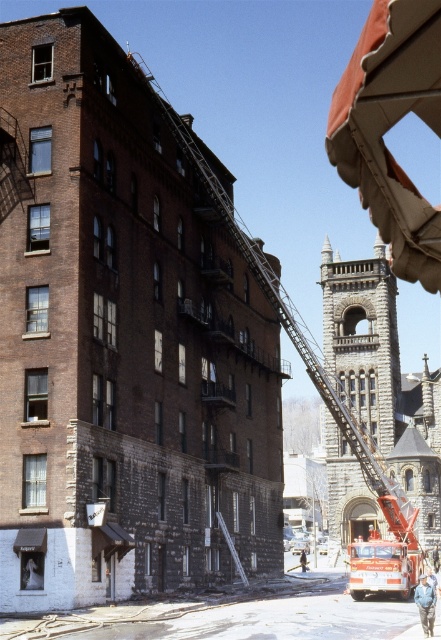
Question: Among these points, which one is nearest to the camera?

Choices:
 (A) (257, 266)
 (B) (231, 545)

Answer: (B)

Question: Does blue denim jacket at lower right have a lesser width compared to light blue denim jacket at lower right?

Choices:
 (A) no
 (B) yes

Answer: (A)

Question: Can you confirm if blue denim jacket at lower right is bigger than light blue denim jacket at lower right?

Choices:
 (A) no
 (B) yes

Answer: (B)

Question: Does red metallic fire truck at right appear on the right side of light blue denim jacket at lower right?

Choices:
 (A) no
 (B) yes

Answer: (A)

Question: Which point is farther to the camera?

Choices:
 (A) blue denim jacket at lower right
 (B) light blue denim jacket at lower right

Answer: (B)

Question: Which of the following is the closest to the observer?

Choices:
 (A) (414, 593)
 (B) (235, 556)

Answer: (A)